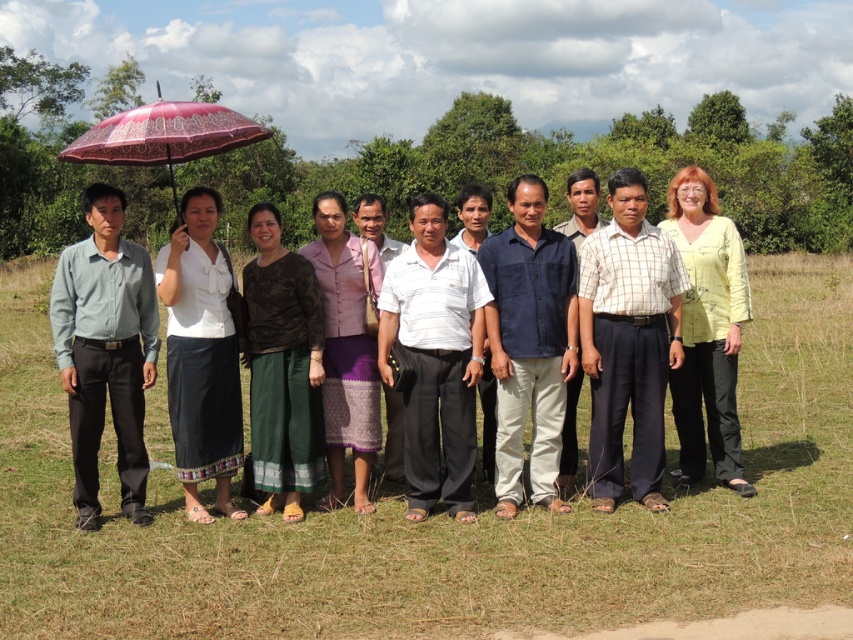
Question: Among these objects, which one is nearest to the camera?

Choices:
 (A) light gray shirt at left
 (B) solid white pants at center

Answer: (B)

Question: Can you confirm if light gray shirt at left is positioned to the right of pink lace umbrella at upper left?

Choices:
 (A) yes
 (B) no

Answer: (A)

Question: Estimate the real-world distances between objects in this image. Which object is farther from the purple woven skirt at center?

Choices:
 (A) pink lace umbrella at upper left
 (B) solid white pants at center
 (C) white woven skirt at center
 (D) light yellow fabric at center

Answer: (A)

Question: Is white woven skirt at center closer to camera compared to light yellow fabric at center?

Choices:
 (A) no
 (B) yes

Answer: (B)

Question: Is white woven skirt at center positioned at the back of light yellow fabric at center?

Choices:
 (A) no
 (B) yes

Answer: (A)

Question: Which object is positioned farthest from the dark green woven skirt at center?

Choices:
 (A) solid white pants at center
 (B) white woven skirt at center
 (C) light gray shirt at left
 (D) purple woven skirt at center

Answer: (A)